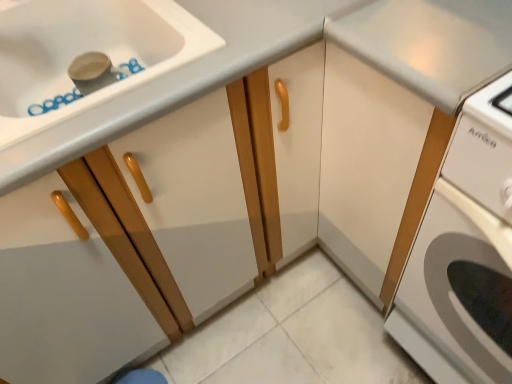
The image size is (512, 384). I want to click on matte wood cabinet at left, the 1th cabinetry from the left, so click(x=173, y=81).

Considering the sizes of objects matte wood cabinet at left, which is the 2th cabinetry from right to left, and white matte cabinet at center, placed as the 1th cabinetry when sorted from right to left, in the image provided, who is bigger, matte wood cabinet at left, which is the 2th cabinetry from right to left, or white matte cabinet at center, placed as the 1th cabinetry when sorted from right to left,?

white matte cabinet at center, placed as the 1th cabinetry when sorted from right to left.

Considering the relative positions of matte wood cabinet at left, which is the 2th cabinetry from right to left, and white matte cabinet at center, placed as the 1th cabinetry when sorted from right to left, in the image provided, is matte wood cabinet at left, which is the 2th cabinetry from right to left, to the right of white matte cabinet at center, placed as the 1th cabinetry when sorted from right to left, from the viewer's perspective?

Incorrect, matte wood cabinet at left, which is the 2th cabinetry from right to left, is not on the right side of white matte cabinet at center, placed as the 1th cabinetry when sorted from right to left.

Does matte wood cabinet at left, which is the 2th cabinetry from right to left, contain white matte cabinet at center, the 2th cabinetry positioned from the left?

That's incorrect, white matte cabinet at center, the 2th cabinetry positioned from the left, is not inside matte wood cabinet at left, which is the 2th cabinetry from right to left.

Is matte wood cabinet at left, which is the 2th cabinetry from right to left, thinner than white matte cabinet at center, the 2th cabinetry positioned from the left?

Yes, matte wood cabinet at left, which is the 2th cabinetry from right to left, is thinner than white matte cabinet at center, the 2th cabinetry positioned from the left.

Based on the photo, is white glossy washing machine at right facing away from white matte cabinet at center, the 2th cabinetry positioned from the left?

No, white glossy washing machine at right is not facing the opposite direction of white matte cabinet at center, the 2th cabinetry positioned from the left.

Which object is closer to the camera taking this photo, white glossy washing machine at right or white matte cabinet at center, the 2th cabinetry positioned from the left?

white glossy washing machine at right is more forward.

Measure the distance between white glossy washing machine at right and white matte cabinet at center, the 2th cabinetry positioned from the left.

A distance of 14.66 centimeters exists between white glossy washing machine at right and white matte cabinet at center, the 2th cabinetry positioned from the left.

Consider the image. From the image's perspective, who appears lower, white glossy washing machine at right or white matte cabinet at center, placed as the 1th cabinetry when sorted from right to left?

white glossy washing machine at right, from the image's perspective.

Between white matte cabinet at center, placed as the 1th cabinetry when sorted from right to left, and white glossy washing machine at right, which one has larger size?

white matte cabinet at center, placed as the 1th cabinetry when sorted from right to left, is bigger.

Choose the correct answer: Is white matte cabinet at center, the 2th cabinetry positioned from the left, inside white glossy washing machine at right or outside it?

white matte cabinet at center, the 2th cabinetry positioned from the left, lies outside white glossy washing machine at right.

From the image's perspective, is white matte cabinet at center, the 2th cabinetry positioned from the left, located above white glossy washing machine at right?

Indeed, from the image's perspective, white matte cabinet at center, the 2th cabinetry positioned from the left, is shown above white glossy washing machine at right.

What's the angular difference between white matte cabinet at center, the 2th cabinetry positioned from the left, and white glossy washing machine at right's facing directions?

They differ by 0.421 degrees in their facing directions.

Considering the positions of objects white matte cabinet at center, placed as the 1th cabinetry when sorted from right to left, and matte wood cabinet at left, the 1th cabinetry from the left, in the image provided, who is more to the right, white matte cabinet at center, placed as the 1th cabinetry when sorted from right to left, or matte wood cabinet at left, the 1th cabinetry from the left,?

white matte cabinet at center, placed as the 1th cabinetry when sorted from right to left.

Between point (351, 83) and point (252, 55), which one is positioned in front?

The point (252, 55) is closer to the camera.

Is white matte cabinet at center, the 2th cabinetry positioned from the left, far away from matte wood cabinet at left, the 1th cabinetry from the left?

No, white matte cabinet at center, the 2th cabinetry positioned from the left, is not far from matte wood cabinet at left, the 1th cabinetry from the left.

From the image's perspective, who appears lower, white matte cabinet at center, placed as the 1th cabinetry when sorted from right to left, or matte wood cabinet at left, which is the 2th cabinetry from right to left?

white matte cabinet at center, placed as the 1th cabinetry when sorted from right to left.

Is matte wood cabinet at left, the 1th cabinetry from the left, surrounding white glossy washing machine at right?

No, white glossy washing machine at right is located outside of matte wood cabinet at left, the 1th cabinetry from the left.

Considering their positions, is matte wood cabinet at left, which is the 2th cabinetry from right to left, located in front of or behind white glossy washing machine at right?

matte wood cabinet at left, which is the 2th cabinetry from right to left, is positioned farther from the viewer than white glossy washing machine at right.

Who is smaller, matte wood cabinet at left, which is the 2th cabinetry from right to left, or white glossy washing machine at right?

With smaller size is matte wood cabinet at left, which is the 2th cabinetry from right to left.

Measure the distance between matte wood cabinet at left, which is the 2th cabinetry from right to left, and white glossy washing machine at right.

matte wood cabinet at left, which is the 2th cabinetry from right to left, and white glossy washing machine at right are 19.98 inches apart.

Is white glossy washing machine at right outside of matte wood cabinet at left, the 1th cabinetry from the left?

Indeed, white glossy washing machine at right is completely outside matte wood cabinet at left, the 1th cabinetry from the left.

You are a GUI agent. You are given a task and a screenshot of the screen. Output one action in this format:
    pyautogui.click(x=<x>, y=<y>)
    Task: Click on the home appliance that appears in front of the matte wood cabinet at left, which is the 2th cabinetry from right to left
    The height and width of the screenshot is (384, 512).
    Given the screenshot: What is the action you would take?
    pyautogui.click(x=464, y=253)

Is point (490, 302) positioned before point (146, 93)?

No, (490, 302) is further to viewer.

Considering the sizes of objects white glossy washing machine at right and matte wood cabinet at left, which is the 2th cabinetry from right to left, in the image provided, who is smaller, white glossy washing machine at right or matte wood cabinet at left, which is the 2th cabinetry from right to left,?

With smaller size is matte wood cabinet at left, which is the 2th cabinetry from right to left.

Locate an element on the screen. This screenshot has width=512, height=384. cabinetry behind the white matte cabinet at center, placed as the 1th cabinetry when sorted from right to left is located at coordinates (173, 81).

In the image, there is a white matte cabinet at center, the 2th cabinetry positioned from the left. Identify the location of home appliance below it (from a real-world perspective). The height and width of the screenshot is (384, 512). (464, 253).

Considering their positions, is white matte cabinet at center, the 2th cabinetry positioned from the left, positioned further to matte wood cabinet at left, which is the 2th cabinetry from right to left, than white glossy washing machine at right?

white glossy washing machine at right lies further to matte wood cabinet at left, which is the 2th cabinetry from right to left, than the other object.

From the image, which object appears to be farther from matte wood cabinet at left, which is the 2th cabinetry from right to left, white glossy washing machine at right or white matte cabinet at center, placed as the 1th cabinetry when sorted from right to left?

The object further to matte wood cabinet at left, which is the 2th cabinetry from right to left, is white glossy washing machine at right.

From the picture: Estimate the real-world distances between objects in this image. Which object is further from white matte cabinet at center, placed as the 1th cabinetry when sorted from right to left, white glossy washing machine at right or matte wood cabinet at left, the 1th cabinetry from the left?

matte wood cabinet at left, the 1th cabinetry from the left, is further to white matte cabinet at center, placed as the 1th cabinetry when sorted from right to left.

Considering their positions, is matte wood cabinet at left, the 1th cabinetry from the left, positioned closer to white glossy washing machine at right than white matte cabinet at center, the 2th cabinetry positioned from the left?

The object closer to white glossy washing machine at right is white matte cabinet at center, the 2th cabinetry positioned from the left.

Looking at the image, which one is located further to white matte cabinet at center, placed as the 1th cabinetry when sorted from right to left, matte wood cabinet at left, the 1th cabinetry from the left, or white glossy washing machine at right?

Among the two, matte wood cabinet at left, the 1th cabinetry from the left, is located further to white matte cabinet at center, placed as the 1th cabinetry when sorted from right to left.

From the image, which object appears to be farther from white glossy washing machine at right, white matte cabinet at center, placed as the 1th cabinetry when sorted from right to left, or matte wood cabinet at left, the 1th cabinetry from the left?

Among the two, matte wood cabinet at left, the 1th cabinetry from the left, is located further to white glossy washing machine at right.

Locate an element on the screen. Image resolution: width=512 pixels, height=384 pixels. cabinetry between matte wood cabinet at left, the 1th cabinetry from the left, and white glossy washing machine at right from left to right is located at coordinates (374, 171).